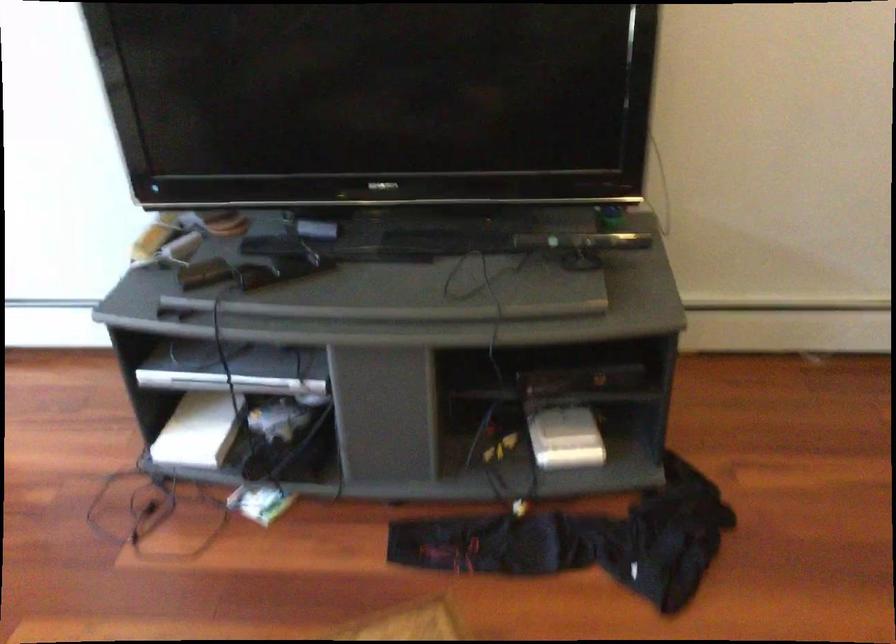
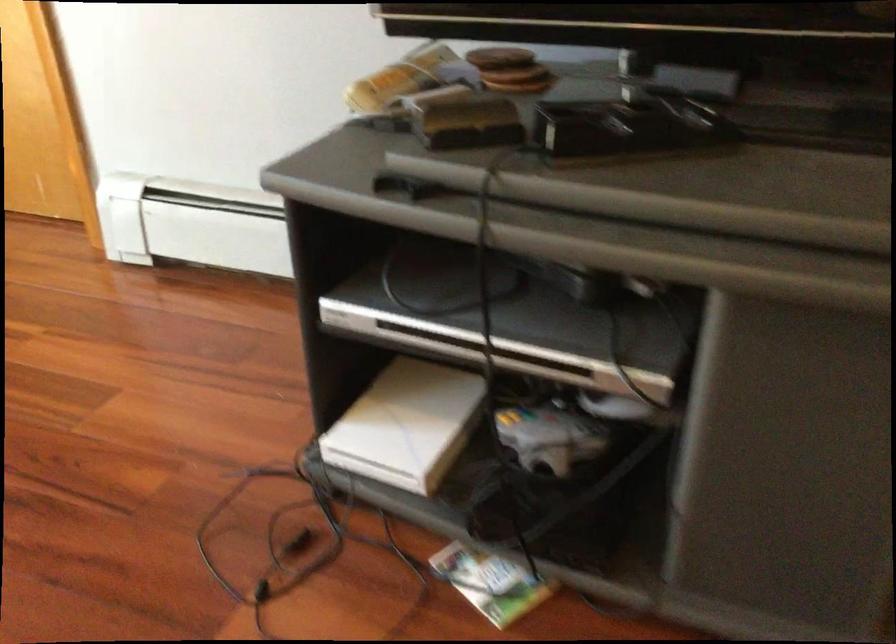
Where in the second image is the point corresponding to point (195, 431) from the first image?

(407, 424)